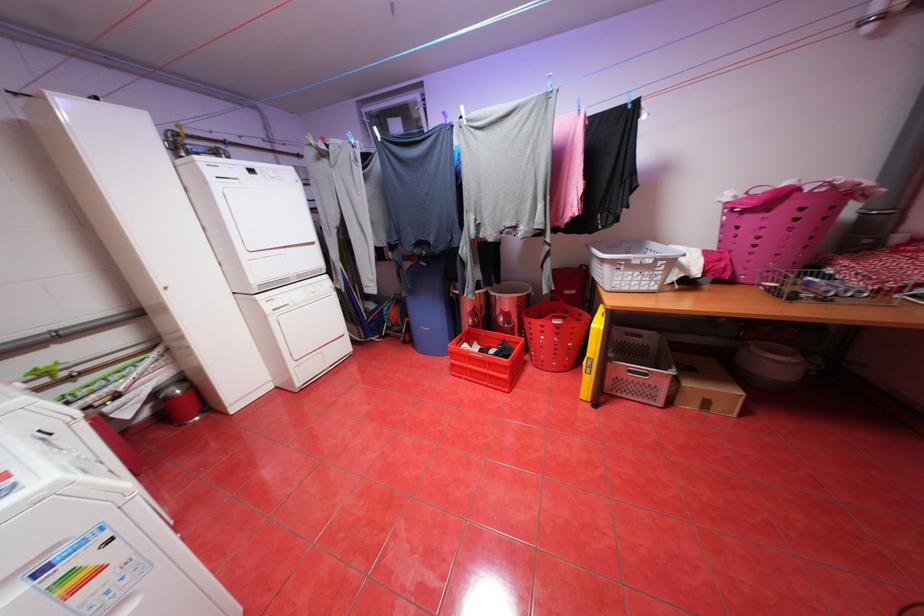
The location [431,304] corresponds to which object?

This point indicates the blue storage bin.